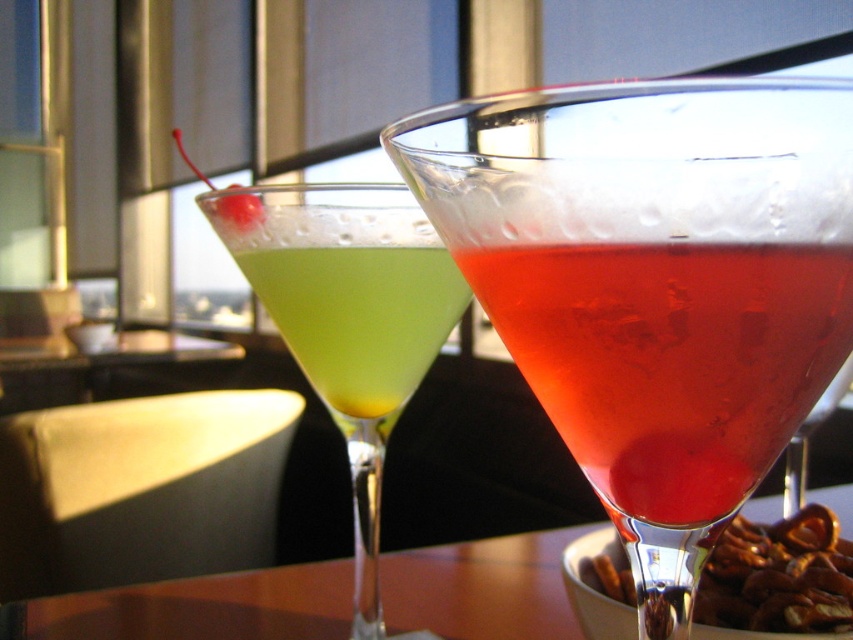
Question: Is wooden table at center above brown crunchy pretzel at lower right?

Choices:
 (A) no
 (B) yes

Answer: (A)

Question: Does translucent glass cocktail at center have a lesser width compared to red glossy cherry at upper center?

Choices:
 (A) yes
 (B) no

Answer: (B)

Question: Is translucent glass cocktail at center behind brown crunchy pretzel at lower right?

Choices:
 (A) no
 (B) yes

Answer: (A)

Question: Which of the following is the closest to the observer?

Choices:
 (A) (225, 198)
 (B) (213, 577)
 (C) (837, 568)

Answer: (A)

Question: Based on their relative distances, which object is nearer to the translucent glass cocktail at center?

Choices:
 (A) red glossy cherry at upper center
 (B) wooden table at center
 (C) brown crunchy pretzel at lower right
 (D) green translucent liquid at center

Answer: (D)

Question: Which object appears closest to the camera in this image?

Choices:
 (A) wooden table at center
 (B) green translucent liquid at center
 (C) red glossy cherry at upper center
 (D) brown crunchy pretzel at lower right

Answer: (B)